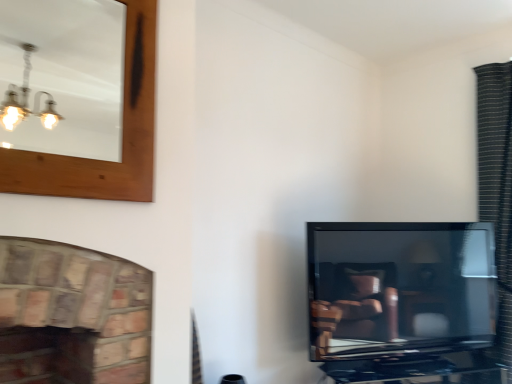
Question: Is point (101, 74) positioned closer to the camera than point (506, 304)?

Choices:
 (A) farther
 (B) closer

Answer: (A)

Question: From a real-world perspective, is wooden-framed mirror at upper left positioned above or below black textured curtain at right?

Choices:
 (A) below
 (B) above

Answer: (B)

Question: Estimate the real-world distances between objects in this image. Which object is closer to the matte black tv at right?

Choices:
 (A) black textured curtain at right
 (B) wooden-framed mirror at upper left

Answer: (A)

Question: Estimate the real-world distances between objects in this image. Which object is closer to the matte black tv at right?

Choices:
 (A) wooden-framed mirror at upper left
 (B) black textured curtain at right

Answer: (B)